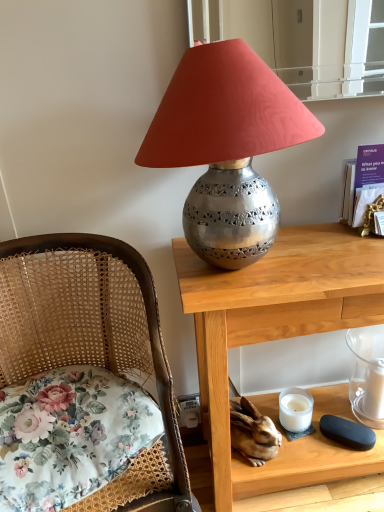
Locate an element on the screen. The width and height of the screenshot is (384, 512). free location above polished wood desk at center (from a real-world perspective) is located at coordinates (311, 254).